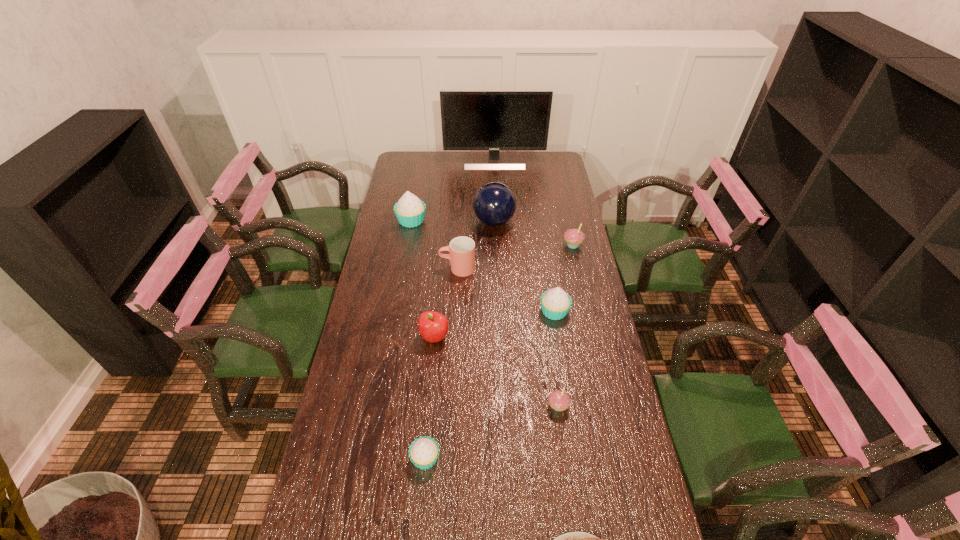
At what (x,y) coordinates should I click in order to perform the action: click on the second farthest white cupcake. Please return your answer as a coordinate pair (x, y). The width and height of the screenshot is (960, 540). Looking at the image, I should click on (555, 303).

The height and width of the screenshot is (540, 960). What are the coordinates of `the fourth nearest object` in the screenshot? It's located at (433, 326).

Find the location of a particular element. apple is located at coordinates (433, 326).

Locate an element on the screen. Image resolution: width=960 pixels, height=540 pixels. the nearest cupcake is located at coordinates (424, 451).

What are the coordinates of `the smallest white cupcake` in the screenshot? It's located at (424, 451).

Where is `the nearer pink cupcake`? The height and width of the screenshot is (540, 960). the nearer pink cupcake is located at coordinates (559, 400).

Identify the location of the fourth farthest cupcake. pos(559,400).

Where is `vacant region located 0.360m on the screen side of the farthest object`? The image size is (960, 540). vacant region located 0.360m on the screen side of the farthest object is located at coordinates (496, 213).

You are a GUI agent. You are given a task and a screenshot of the screen. Output one action in this format:
    pyautogui.click(x=<x>, y=<y>)
    Task: Click on the free region located on the surface of the ninth shortest object near the finger holes
    This screenshot has width=960, height=540.
    Given the screenshot: What is the action you would take?
    pyautogui.click(x=462, y=222)

Where is `vacant space situated 0.210m on the surface of the ninth shortest object near the finger holes`? The width and height of the screenshot is (960, 540). vacant space situated 0.210m on the surface of the ninth shortest object near the finger holes is located at coordinates coord(425,222).